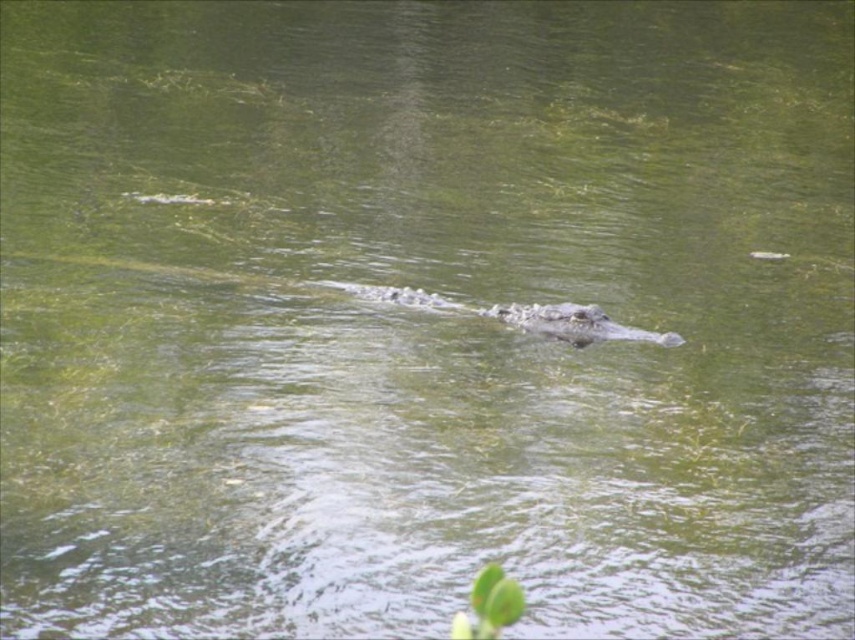
Question: In this image, where is dark gray textured crocodile at center located relative to dark green scaly crocodile at center?

Choices:
 (A) left
 (B) right

Answer: (A)

Question: Which point is farther to the camera?

Choices:
 (A) dark green scaly crocodile at center
 (B) dark gray textured crocodile at center

Answer: (B)

Question: Where is dark gray textured crocodile at center located in relation to dark green scaly crocodile at center in the image?

Choices:
 (A) below
 (B) above

Answer: (B)

Question: Which point is farther from the camera taking this photo?

Choices:
 (A) (597, 332)
 (B) (578, 308)

Answer: (A)

Question: Observing the image, what is the correct spatial positioning of dark gray textured crocodile at center in reference to dark green scaly crocodile at center?

Choices:
 (A) below
 (B) above

Answer: (B)

Question: Which of the following is the closest to the observer?

Choices:
 (A) (523, 310)
 (B) (638, 336)

Answer: (B)